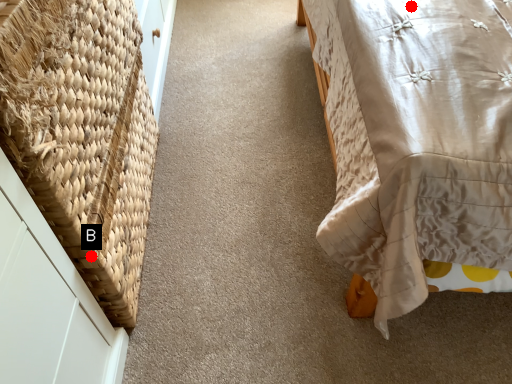
Question: Two points are circled on the image, labeled by A and B beside each circle. Which point appears farthest from the camera in this image?

Choices:
 (A) A is further
 (B) B is further

Answer: (A)